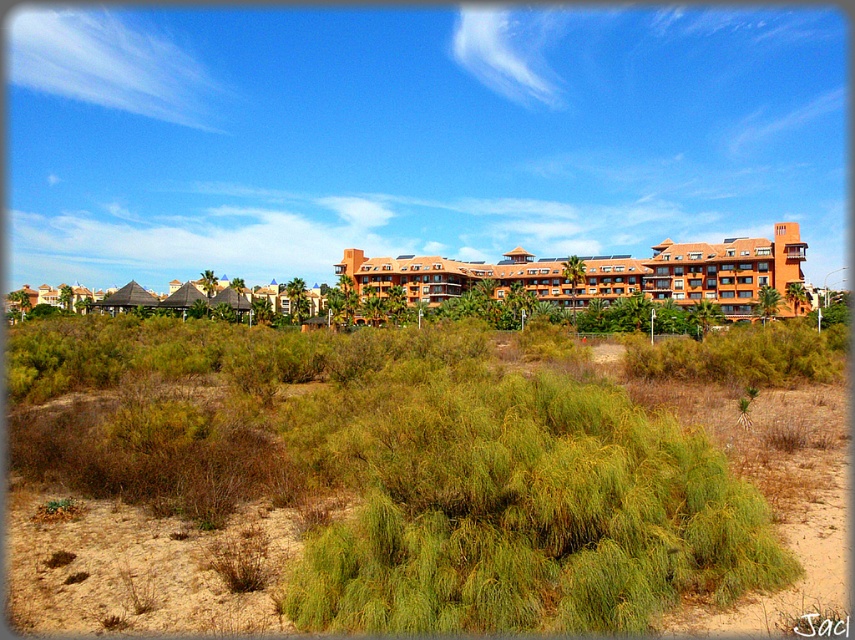
From the picture: You are a landscape architect designing a new garden for the orange clay resort at center. You need to know if the green shrubbery at center is wide enough to block the view of the resort from the beach. Can you determine this based on the provided information?

The green shrubbery at center is thinner than the orange clay resort at center, so it might not be wide enough to fully block the view of the resort from the beach.

You are a landscape architect planning to install a new pathway between the green shrubbery at center and the orange clay resort at center. Considering their heights, which object might require trimming or adjustment to ensure the pathway is level?

The green shrubbery at center is shorter than the orange clay resort at center. To ensure the pathway is level, the orange clay resort at center would need to be adjusted since it is taller, but since it is a building, trimming the green shrubbery at center might be more feasible to match the height difference.

Consider the image. You are planning to install a new pathway between the green shrubbery at center and the orange clay resort at center. Given their sizes, which area would require more adjustments to accommodate the pathway?

The orange clay resort at center occupies more space than the green shrubbery at center, so adjustments would be needed around the orange clay resort at center to accommodate the pathway.